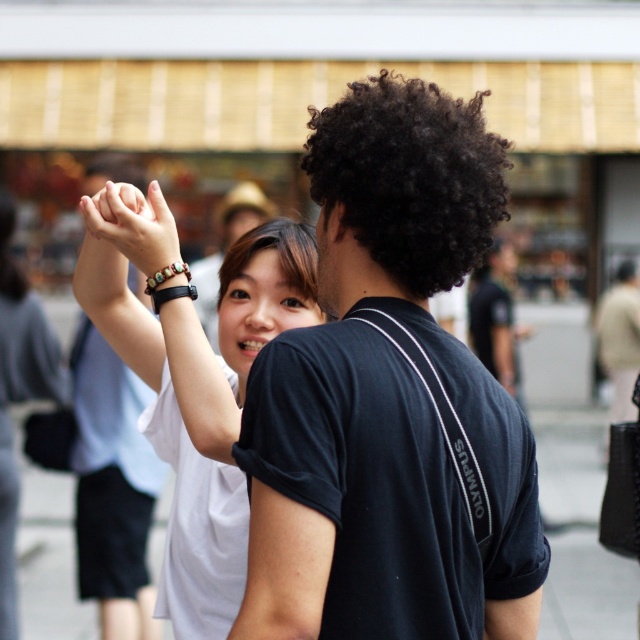
Does white matte bracelet at upper left have a greater height compared to black curly hair at center?

Indeed, white matte bracelet at upper left has a greater height compared to black curly hair at center.

In the scene shown: Which is below, white matte bracelet at upper left or black curly hair at center?

white matte bracelet at upper left

Between point (220, 440) and point (225, 275), which one is positioned in front?

Positioned in front is point (220, 440).

Locate an element on the screen. The image size is (640, 640). white matte bracelet at upper left is located at coordinates (193, 381).

Does matte brown bracelet at upper center appear on the left side of black curly hair at center?

Correct, you'll find matte brown bracelet at upper center to the left of black curly hair at center.

Who is positioned more to the left, matte brown bracelet at upper center or black curly hair at center?

From the viewer's perspective, matte brown bracelet at upper center appears more on the left side.

Between point (156, 193) and point (240, 236), which one is positioned in front?

Point (156, 193)

Find the location of `matte brown bracelet at upper center`. matte brown bracelet at upper center is located at coordinates (132, 225).

Is point (8, 464) closer to viewer compared to point (100, 192)?

No, it is behind (100, 192).

Is white matte shirt at upper left further to the viewer compared to matte brown bracelet at upper center?

Yes, white matte shirt at upper left is behind matte brown bracelet at upper center.

Describe the element at coordinates (19, 394) in the screenshot. I see `white matte shirt at upper left` at that location.

I want to click on white matte shirt at upper left, so click(x=19, y=394).